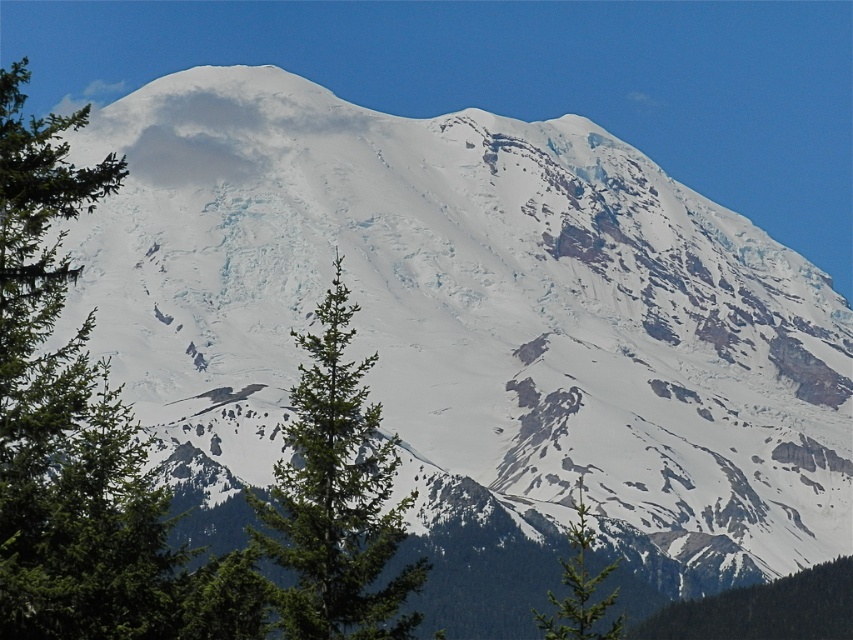
In the scene shown: Between green needle-like tree at center and green textured pine tree at center, which one has less height?

green textured pine tree at center

Does green needle-like tree at center lie behind green textured pine tree at center?

No, green needle-like tree at center is in front of green textured pine tree at center.

Which is in front, point (291, 545) or point (563, 627)?

Positioned in front is point (291, 545).

Identify the location of green needle-like tree at center. (335, 497).

Can you confirm if green needle-like tree at center is positioned to the left of green matte tree at lower right?

Correct, you'll find green needle-like tree at center to the left of green matte tree at lower right.

Does green needle-like tree at center have a smaller size compared to green matte tree at lower right?

Actually, green needle-like tree at center might be larger than green matte tree at lower right.

Between point (317, 435) and point (834, 572), which one is positioned behind?

The point (834, 572) is more distant.

Identify the location of green needle-like tree at center. The image size is (853, 640). (335, 497).

Does green textured pine tree at left have a greater width compared to green textured pine tree at center?

Indeed, green textured pine tree at left has a greater width compared to green textured pine tree at center.

Measure the distance between point (115,412) and camera.

They are 626.94 meters apart.

This screenshot has height=640, width=853. What are the coordinates of `green textured pine tree at left` in the screenshot? It's located at (65, 417).